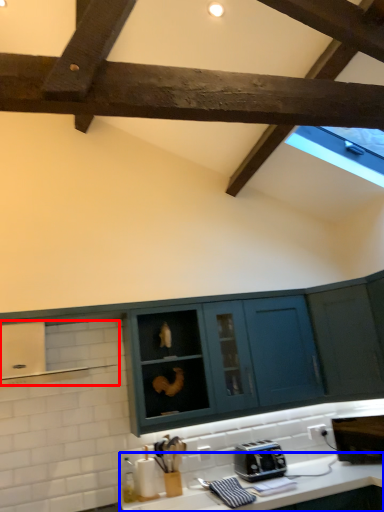
Question: Which point is closer to the camera, exhaust hood (highlighted by a red box) or countertop (highlighted by a blue box)?

Choices:
 (A) exhaust hood
 (B) countertop

Answer: (B)